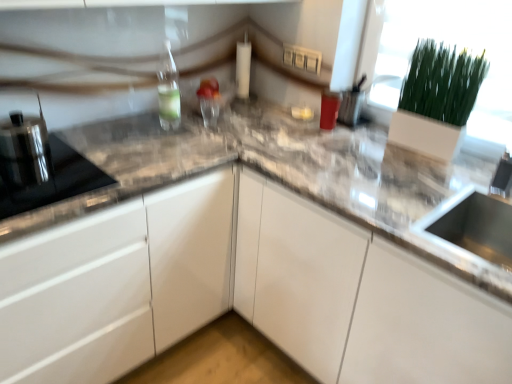
In order to click on space that is in front of satin black kettle at left, placed as the 2th appliance when sorted from front to back in this screenshot , I will do `click(26, 180)`.